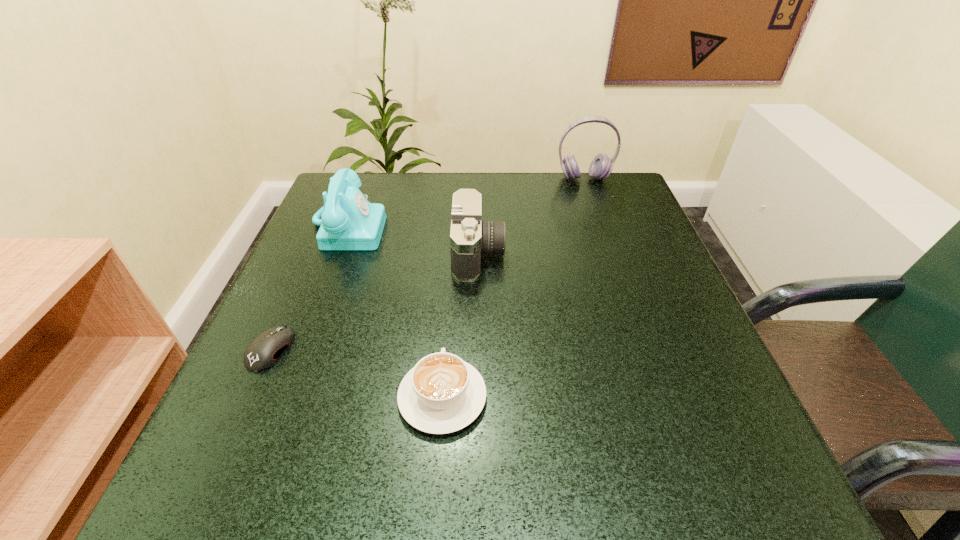
I want to click on the tallest object, so click(601, 166).

I want to click on the rightmost object, so click(601, 166).

The width and height of the screenshot is (960, 540). I want to click on the second tallest object, so click(349, 221).

At what (x,y) coordinates should I click in order to perform the action: click on camera. Please return your answer as a coordinate pair (x, y). The height and width of the screenshot is (540, 960). Looking at the image, I should click on point(470,237).

At what (x,y) coordinates should I click in order to perform the action: click on cappuccino. Please return your answer as a coordinate pair (x, y). This screenshot has height=540, width=960. Looking at the image, I should click on (442, 394).

This screenshot has width=960, height=540. Find the location of `computer equipment`. computer equipment is located at coordinates (263, 352).

Find the location of a particular element. This screenshot has height=540, width=960. vacant space located 0.280m on the headband and ear cups of the farthest object is located at coordinates (610, 253).

You are a GUI agent. You are given a task and a screenshot of the screen. Output one action in this format:
    pyautogui.click(x=<x>, y=<y>)
    Task: Click on the free location located on the dial of the fourth shortest object
    
    Given the screenshot: What is the action you would take?
    pyautogui.click(x=534, y=227)

The image size is (960, 540). Identify the location of vacant space situated 0.090m on the front-facing side of the camera. (547, 253).

The width and height of the screenshot is (960, 540). In order to click on free space located on the side of the fourth tallest object with the handle in this screenshot , I will do `click(451, 276)`.